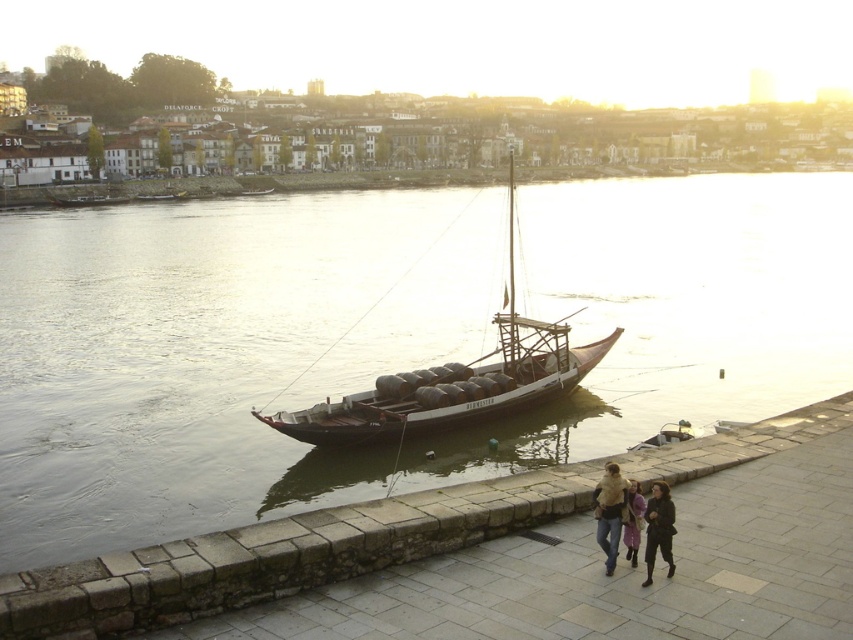
Consider the image. Does brown leather jacket at lower center have a larger size compared to light brown leather jacket at lower right?

Indeed, brown leather jacket at lower center has a larger size compared to light brown leather jacket at lower right.

Does point (630, 540) come farther from viewer compared to point (596, 515)?

No, it is in front of (596, 515).

The width and height of the screenshot is (853, 640). I want to click on brown leather jacket at lower center, so click(x=618, y=515).

Is transparent water at center taller than wooden barrel boat at center?

Indeed, transparent water at center has a greater height compared to wooden barrel boat at center.

Does transparent water at center appear over wooden barrel boat at center?

Yes.

Between point (32, 502) and point (450, 413), which one is positioned in front?

Point (32, 502) is in front.

Find the location of a particular element. This screenshot has height=640, width=853. transparent water at center is located at coordinates (357, 316).

Is brown leather jacket at lower center to the right of light purple fabric coat at lower center from the viewer's perspective?

No, brown leather jacket at lower center is not to the right of light purple fabric coat at lower center.

Is brown leather jacket at lower center above light purple fabric coat at lower center?

Correct, brown leather jacket at lower center is located above light purple fabric coat at lower center.

The image size is (853, 640). Describe the element at coordinates (618, 515) in the screenshot. I see `brown leather jacket at lower center` at that location.

This screenshot has width=853, height=640. I want to click on brown leather jacket at lower center, so click(x=618, y=515).